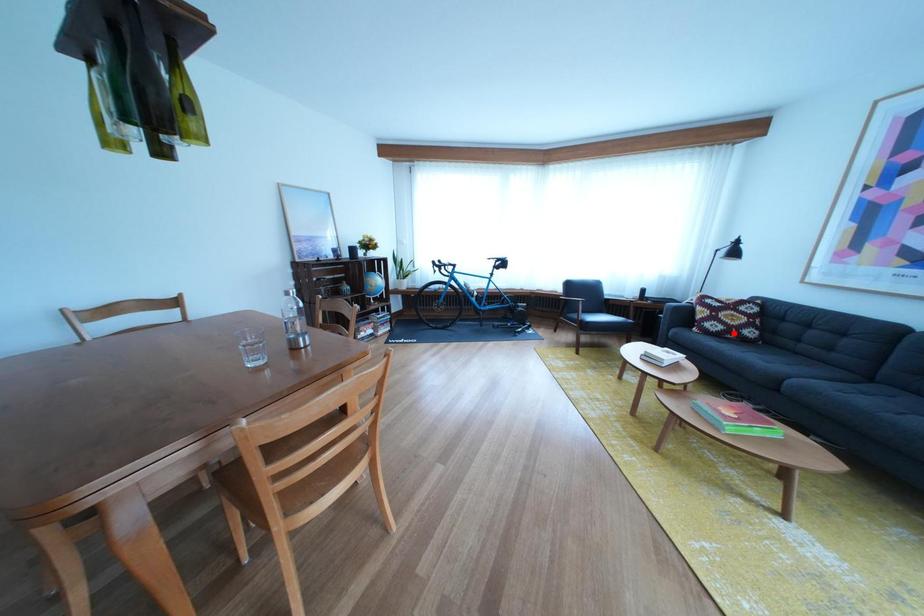
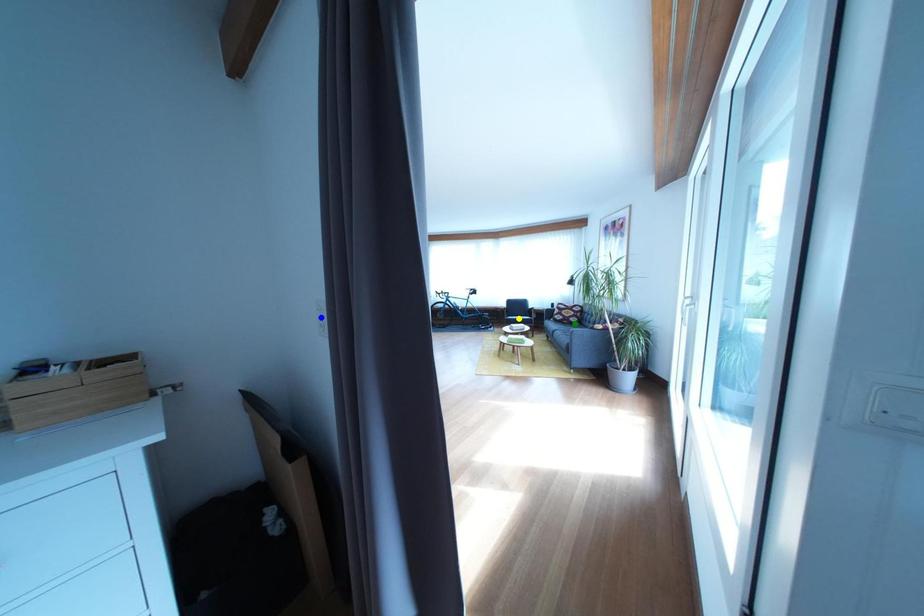
Question: I am providing you with two images of the same scene from different viewpoints. A red point is marked on the first image. You are given multiple points on the second image. Which point in image 2 represents the same 3d spot as the red point in image 1?

Choices:
 (A) blue point
 (B) yellow point
 (C) green point

Answer: (C)